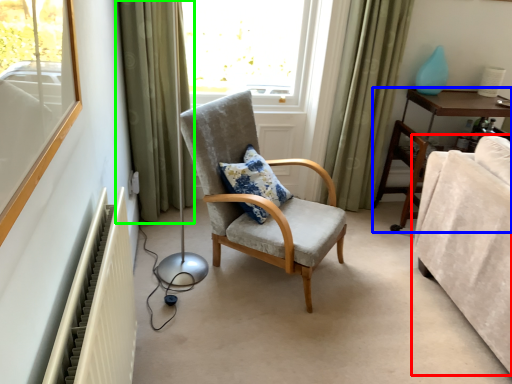
Question: Which object is the closest to the studio couch (highlighted by a red box)? Choose among these: dresser (highlighted by a blue box) or curtain (highlighted by a green box).

Choices:
 (A) dresser
 (B) curtain

Answer: (A)